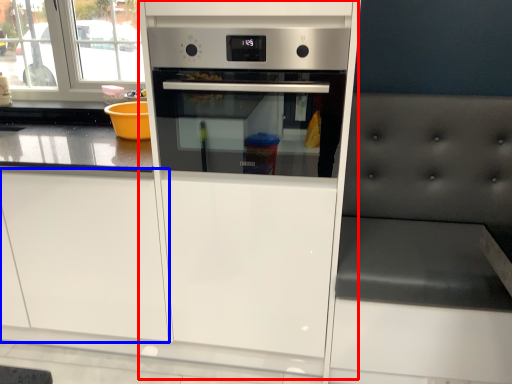
Question: Which of the following is the farthest to the observer, fridge (highlighted by a red box) or drawer (highlighted by a blue box)?

Choices:
 (A) fridge
 (B) drawer

Answer: (B)